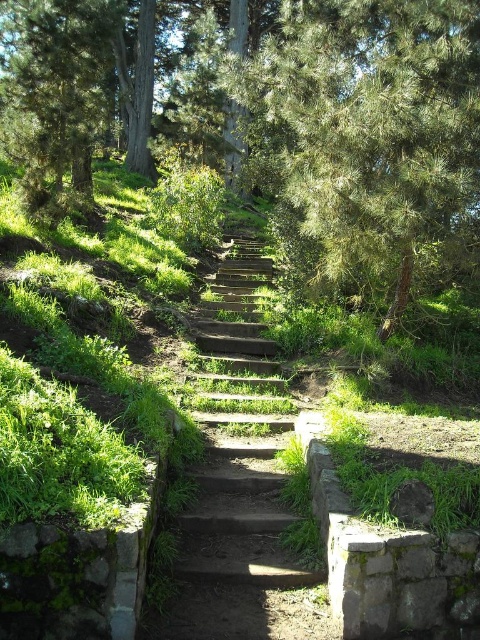
Question: Which of the following is the closest to the observer?

Choices:
 (A) (227, 458)
 (B) (120, 51)

Answer: (A)

Question: Which object is closer to the camera taking this photo?

Choices:
 (A) green textured pine forest at center
 (B) wooden stairs at center

Answer: (B)

Question: Does green textured pine forest at center have a greater width compared to wooden stairs at center?

Choices:
 (A) yes
 (B) no

Answer: (A)

Question: Which point is farther to the camera?

Choices:
 (A) wooden stairs at center
 (B) green textured pine forest at center

Answer: (B)

Question: Is green textured pine forest at center thinner than wooden stairs at center?

Choices:
 (A) no
 (B) yes

Answer: (A)

Question: Is green textured pine forest at center positioned behind wooden stairs at center?

Choices:
 (A) no
 (B) yes

Answer: (B)